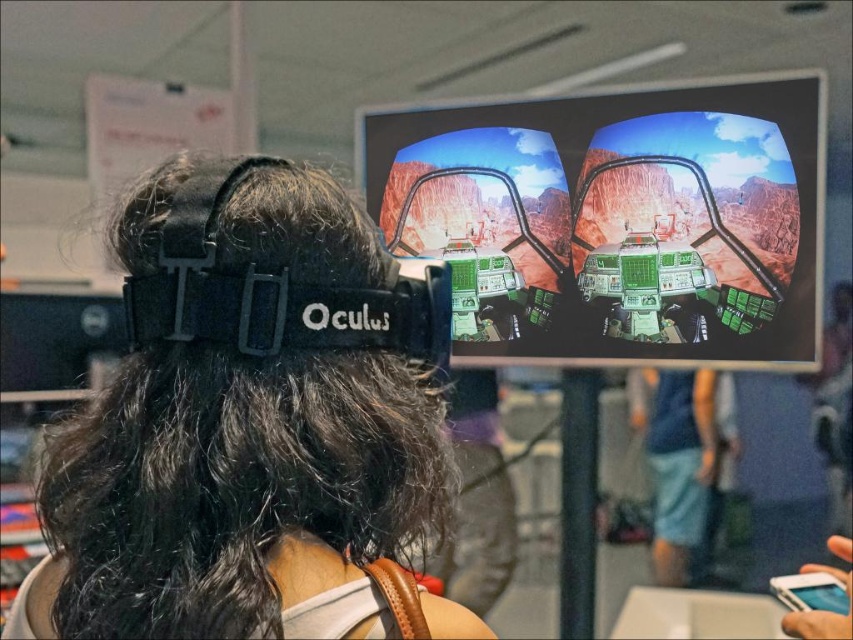
Does point (675, 358) come in front of point (711, 440)?

That is True.

At what (x,y) coordinates should I click in order to perform the action: click on green matte cockpit at center. Please return your answer as a coordinate pair (x, y). Image resolution: width=853 pixels, height=640 pixels. Looking at the image, I should click on (616, 220).

Can you confirm if black matte vr headset at upper center is wider than green matte cockpit at center?

In fact, black matte vr headset at upper center might be narrower than green matte cockpit at center.

Between point (181, 561) and point (567, 104), which one is positioned in front?

Point (181, 561)

Is point (26, 605) closer to viewer compared to point (471, 348)?

Yes, point (26, 605) is closer to viewer.

Locate an element on the screen. This screenshot has height=640, width=853. black matte vr headset at upper center is located at coordinates (252, 426).

Which is in front, point (643, 435) or point (799, 612)?

Point (799, 612) is in front.

Who is positioned more to the left, blue denim shorts at lower right or white matte phone at center?

Positioned to the left is white matte phone at center.

Is point (694, 397) positioned behind point (809, 632)?

That is True.

Identify the location of blue denim shorts at lower right. (x=676, y=460).